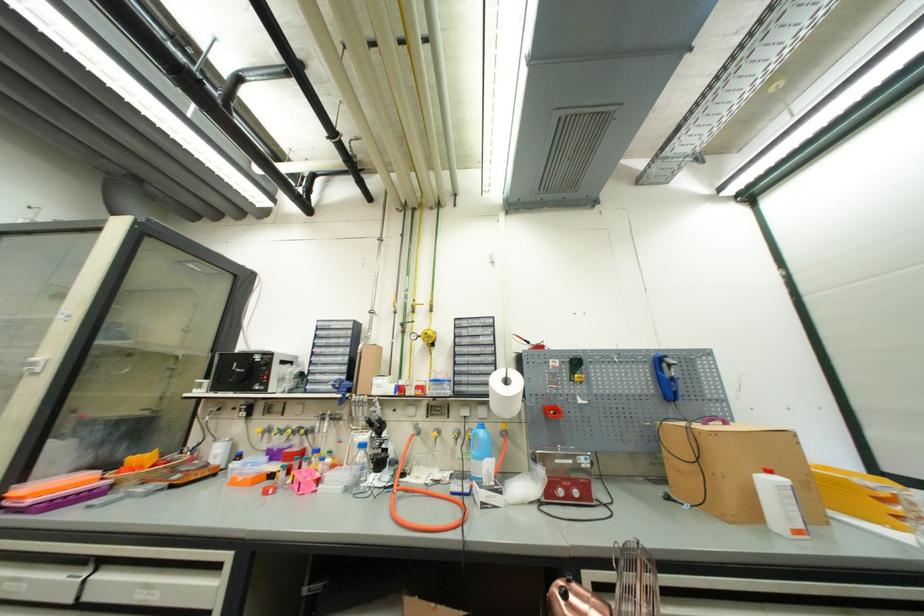
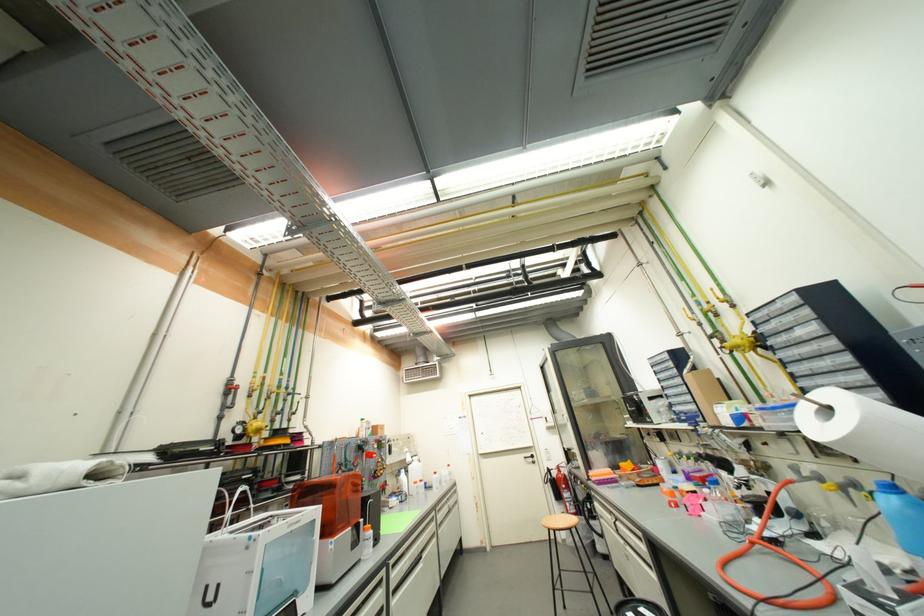
Locate, in the second image, the point that corresponds to the point at 482,430 in the first image.

(889, 493)